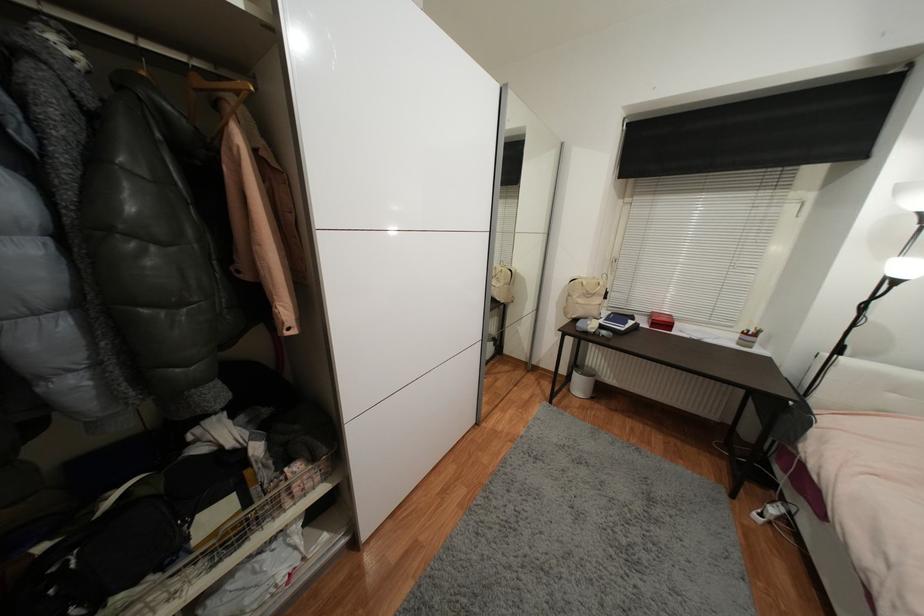
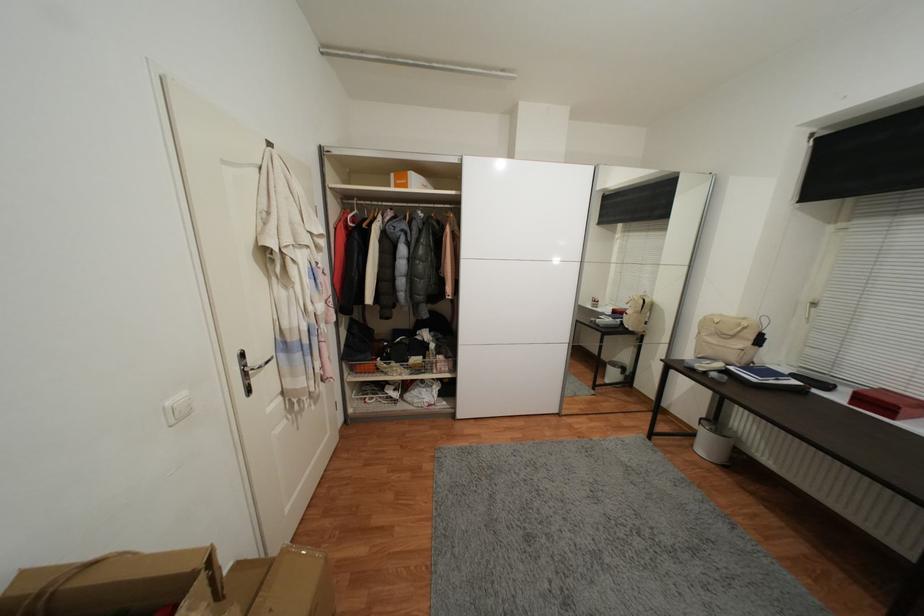
Find the pixel in the second image that matches point 599,280 in the first image.

(748, 321)